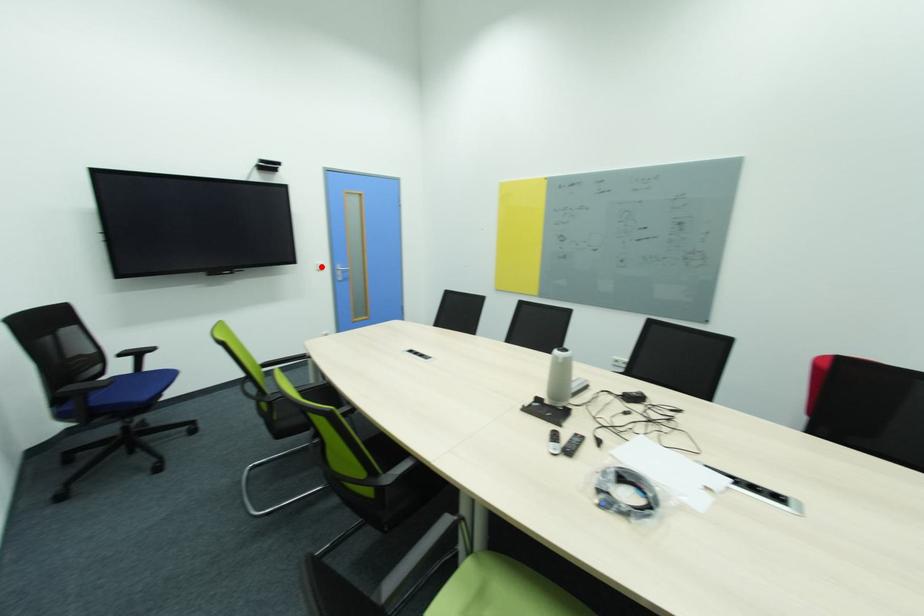
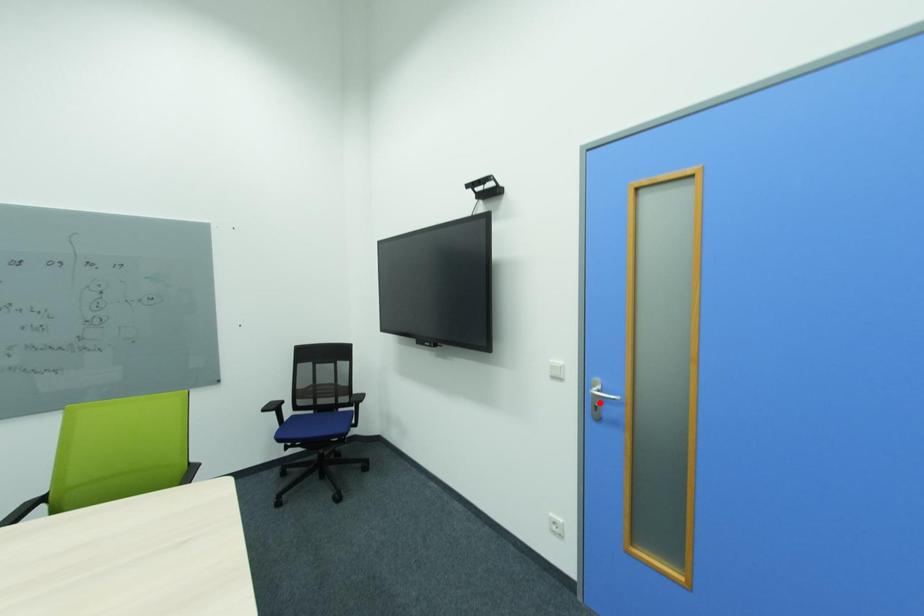
I am providing you with two images of the same scene from different viewpoints. A red point is marked on the first image and another point is marked on the second image. Are the points marked in image1 and image2 representing the same 3D position?

No